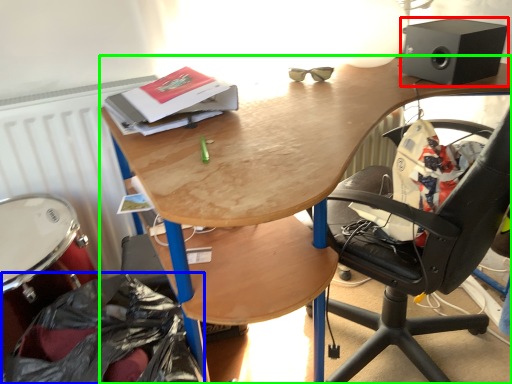
Question: Estimate the real-world distances between objects in this image. Which object is farther from loudspeaker (highlighted by a red box), garbage (highlighted by a blue box) or desk (highlighted by a green box)?

Choices:
 (A) garbage
 (B) desk

Answer: (A)